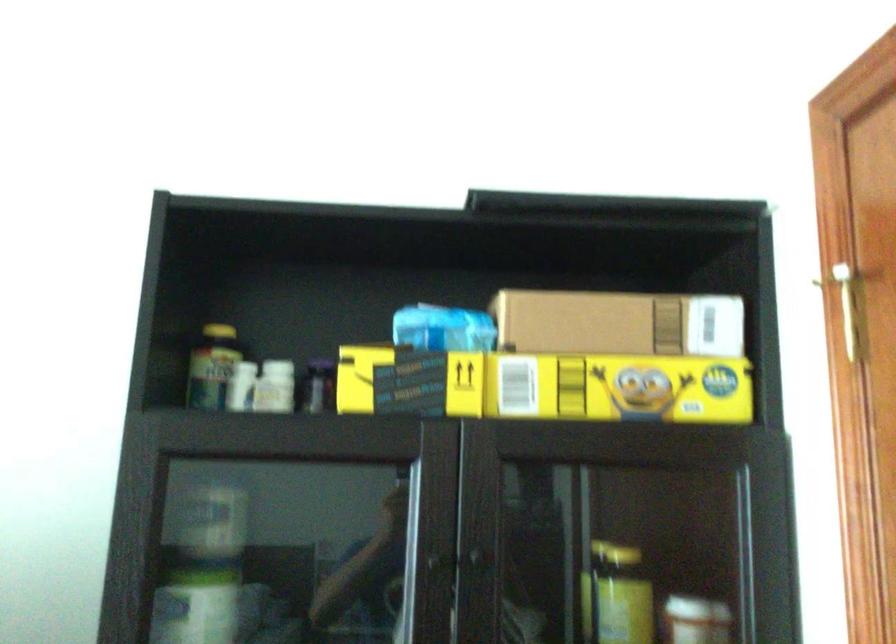
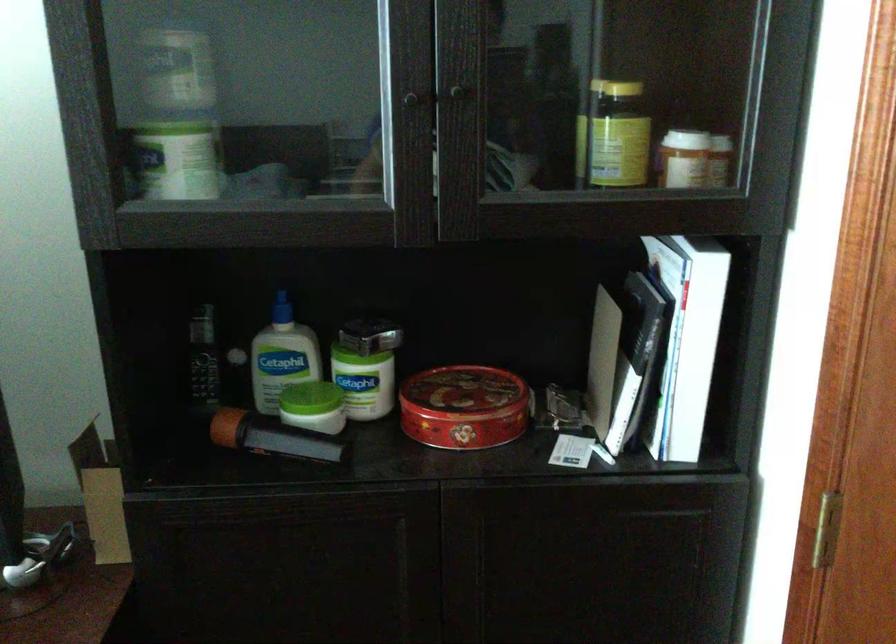
The point at [476,558] is marked in the first image. Where is the corresponding point in the second image?

(454, 91)